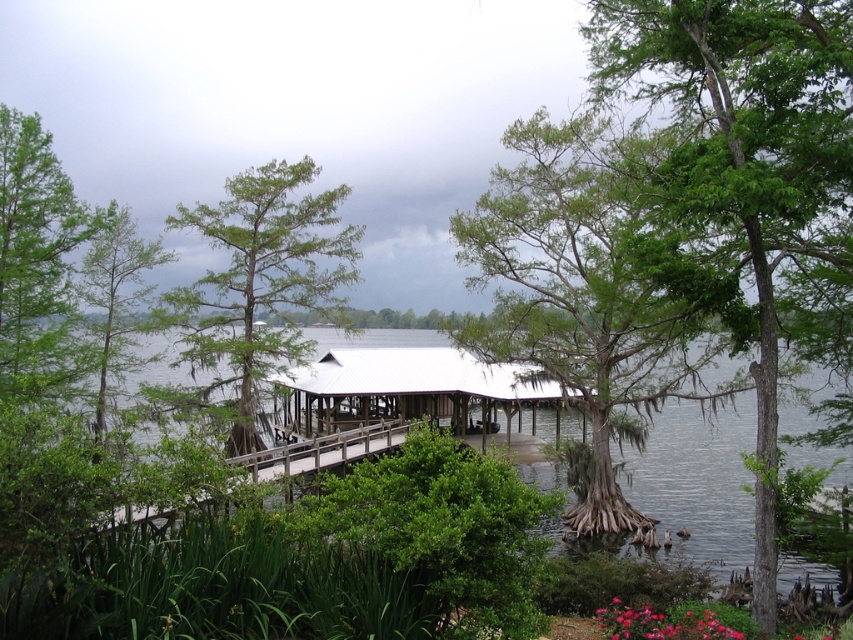
You are planning to build a small garden shed near the green rough bark tree at upper center and the white wooden hut at center. Considering their sizes, which object should you place the shed closer to to ensure it doesn,t block the view of the taller one?

The green rough bark tree at upper center is much taller than the white wooden hut at center. To avoid blocking the view of the taller tree, you should place the shed closer to the white wooden hut at center.

You are standing at the wooden dock with a covered white roof and want to walk towards the point labeled as point (440, 365). Which direction should you move relative to the point labeled as point (699, 52)?

To reach point (440, 365) from the wooden dock, you should move away from point (699, 52) since point (699, 52) is in front of point (440, 365).

You are a hiker standing at the edge of the lake and want to take a photo of the white wooden hut at center without the green rough bark tree at upper center blocking the view. Which direction should you move to ensure the tree is out of the frame?

The green rough bark tree at upper center is in front of the white wooden hut at center, so you should move to the right or left to position yourself where the tree is no longer blocking the view of the hut.